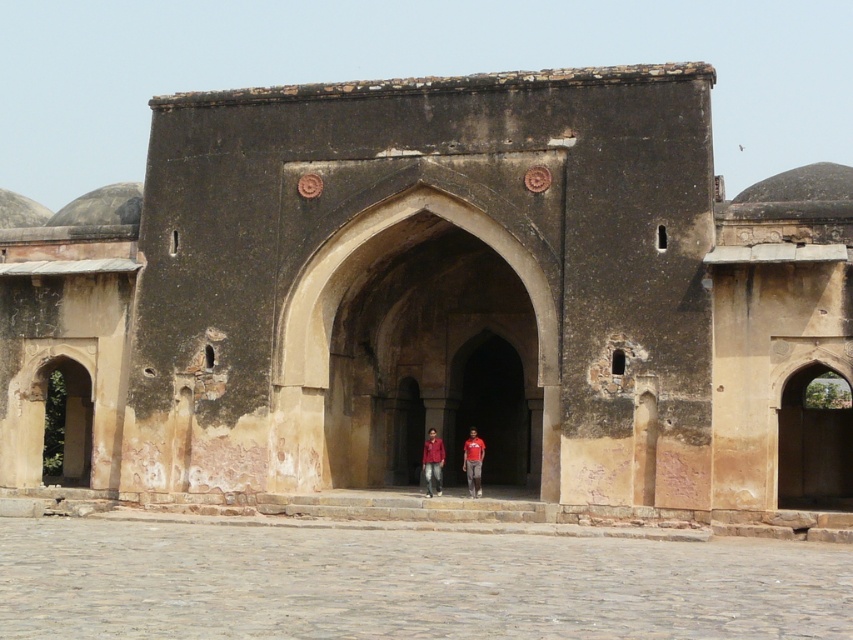
Question: Does matte red shirt at center appear on the left side of red shirt at center?

Choices:
 (A) no
 (B) yes

Answer: (B)

Question: Does matte red shirt at center come in front of red shirt at center?

Choices:
 (A) no
 (B) yes

Answer: (A)

Question: Can you confirm if matte red shirt at center is positioned to the right of red shirt at center?

Choices:
 (A) yes
 (B) no

Answer: (B)

Question: Which object is farther from the camera taking this photo?

Choices:
 (A) red shirt at center
 (B) matte red shirt at center

Answer: (B)